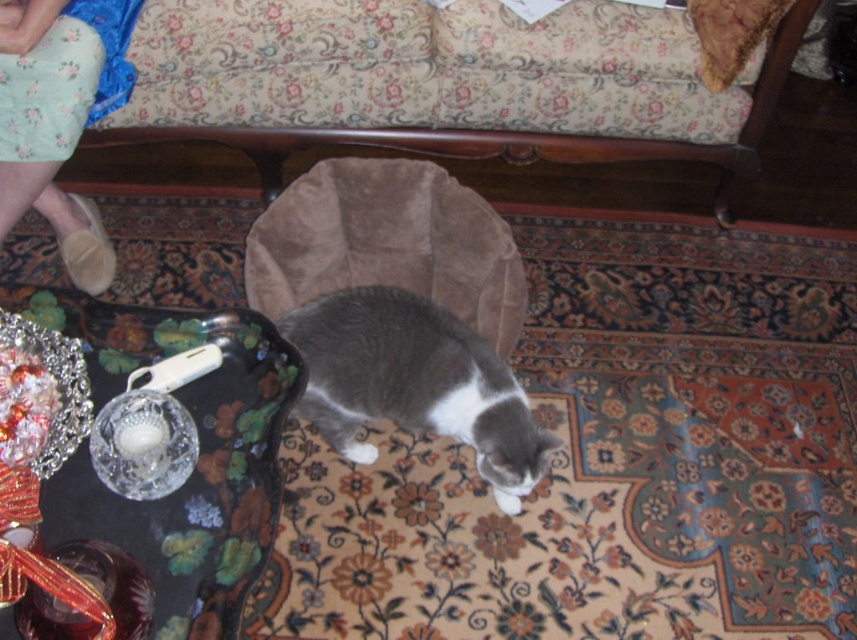
Question: Which of these objects is positioned closest to the suede cat bed at center?

Choices:
 (A) suede couch at center
 (B) gray soft fur cat at center
 (C) velvet cushion at upper right

Answer: (B)

Question: Among these objects, which one is nearest to the camera?

Choices:
 (A) suede cat bed at center
 (B) velvet cushion at upper right
 (C) gray soft fur cat at center

Answer: (C)

Question: Where is suede cat bed at center located in relation to suede couch at center in the image?

Choices:
 (A) right
 (B) left

Answer: (B)

Question: Which point is farther to the camera?

Choices:
 (A) (234, 144)
 (B) (282, 220)

Answer: (A)

Question: Does gray soft fur cat at center appear on the right side of velvet cushion at upper right?

Choices:
 (A) no
 (B) yes

Answer: (A)

Question: Where is suede cat bed at center located in relation to velvet cushion at upper right in the image?

Choices:
 (A) above
 (B) below

Answer: (B)